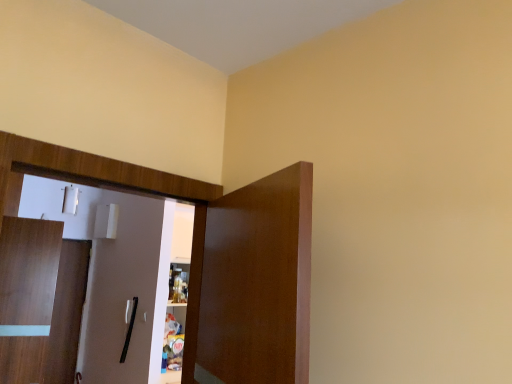
Question: Does wooden dresser at left have a greater height compared to brown wooden door at center, the first door positioned from the front?

Choices:
 (A) yes
 (B) no

Answer: (A)

Question: Is wooden dresser at left wider than brown wooden door at center, positioned as the 2th door in bottom-to-top order?

Choices:
 (A) yes
 (B) no

Answer: (B)

Question: From the image's perspective, does wooden dresser at left appear higher than brown wooden door at center, the 1th door viewed from the top?

Choices:
 (A) no
 (B) yes

Answer: (B)

Question: From a real-world perspective, is wooden dresser at left under brown wooden door at center, acting as the 2th door starting from the left?

Choices:
 (A) yes
 (B) no

Answer: (B)

Question: From a real-world perspective, is wooden dresser at left over brown wooden door at center, acting as the 2th door starting from the left?

Choices:
 (A) no
 (B) yes

Answer: (B)

Question: Is wooden dresser at left oriented away from brown wooden door at center, positioned as the 2th door in bottom-to-top order?

Choices:
 (A) yes
 (B) no

Answer: (A)

Question: Is wooden dresser at left to the right of wooden door at left, the 2th door in the top-to-bottom sequence, from the viewer's perspective?

Choices:
 (A) yes
 (B) no

Answer: (A)

Question: Are wooden dresser at left and wooden door at left, the 2th door when ordered from front to back, far apart?

Choices:
 (A) yes
 (B) no

Answer: (A)

Question: Is wooden dresser at left positioned in front of wooden door at left, the 2th door when ordered from front to back?

Choices:
 (A) yes
 (B) no

Answer: (A)

Question: Can you confirm if wooden dresser at left is taller than wooden door at left, the 2th door when ordered from front to back?

Choices:
 (A) yes
 (B) no

Answer: (B)

Question: Is wooden dresser at left directly adjacent to wooden door at left, acting as the first door starting from the bottom?

Choices:
 (A) yes
 (B) no

Answer: (B)

Question: From a real-world perspective, is wooden dresser at left beneath wooden door at left, which ranks as the 1th door in left-to-right order?

Choices:
 (A) no
 (B) yes

Answer: (A)

Question: From the image's perspective, is wooden door at left, the 2th door in the top-to-bottom sequence, above wooden dresser at left?

Choices:
 (A) no
 (B) yes

Answer: (A)